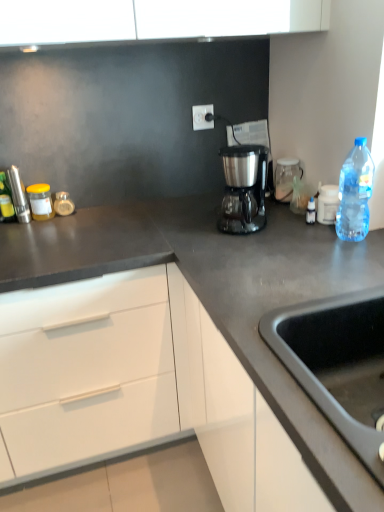
Find the location of `free spot to the left of white plastic container at upper right, the second appliance from the left`. free spot to the left of white plastic container at upper right, the second appliance from the left is located at coordinates (284, 223).